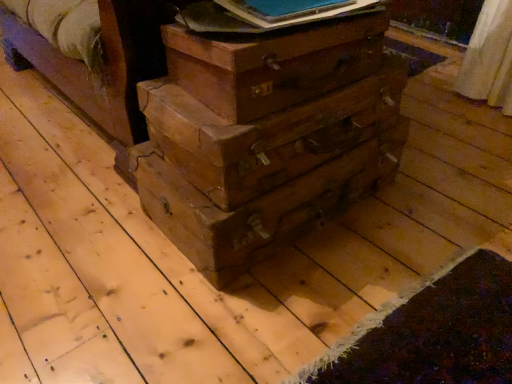
Question: Can you confirm if wooden drawer at center, placed as the second drawer when sorted from top to bottom, is wider than wooden drawer at center, the second drawer positioned from the bottom?

Choices:
 (A) no
 (B) yes

Answer: (B)

Question: Considering the relative sizes of wooden drawer at center, placed as the second drawer when sorted from top to bottom, and wooden drawer at center, the second drawer positioned from the bottom, in the image provided, is wooden drawer at center, placed as the second drawer when sorted from top to bottom, shorter than wooden drawer at center, the second drawer positioned from the bottom,?

Choices:
 (A) yes
 (B) no

Answer: (A)

Question: Does wooden drawer at center, placed as the second drawer when sorted from top to bottom, have a greater height compared to wooden drawer at center, the second drawer positioned from the bottom?

Choices:
 (A) yes
 (B) no

Answer: (B)

Question: From the image's perspective, does wooden drawer at center, placed as the second drawer when sorted from top to bottom, appear lower than wooden drawer at center, the second drawer positioned from the bottom?

Choices:
 (A) no
 (B) yes

Answer: (B)

Question: From a real-world perspective, is wooden drawer at center, which is counted as the 1th drawer, starting from the bottom, located higher than wooden drawer at center, the second drawer positioned from the bottom?

Choices:
 (A) yes
 (B) no

Answer: (B)

Question: From the image's perspective, is wooden drawer at center, which is counted as the 1th drawer, starting from the bottom, over wooden drawer at center, which is the 1th drawer from top to bottom?

Choices:
 (A) yes
 (B) no

Answer: (B)

Question: Is wooden drawer at center, the second drawer positioned from the bottom, bigger than blue paper at upper center?

Choices:
 (A) no
 (B) yes

Answer: (B)

Question: Is the surface of wooden drawer at center, the second drawer positioned from the bottom, in direct contact with blue paper at upper center?

Choices:
 (A) no
 (B) yes

Answer: (A)

Question: From a real-world perspective, is wooden drawer at center, which is the 1th drawer from top to bottom, positioned under blue paper at upper center based on gravity?

Choices:
 (A) no
 (B) yes

Answer: (B)

Question: Is wooden drawer at center, which is the 1th drawer from top to bottom, outside of blue paper at upper center?

Choices:
 (A) yes
 (B) no

Answer: (A)

Question: Does wooden drawer at center, the second drawer positioned from the bottom, have a smaller size compared to blue paper at upper center?

Choices:
 (A) no
 (B) yes

Answer: (A)

Question: Does wooden drawer at center, which is the 1th drawer from top to bottom, turn towards blue paper at upper center?

Choices:
 (A) no
 (B) yes

Answer: (A)

Question: Is blue paper at upper center smaller than wooden drawer at center, placed as the second drawer when sorted from top to bottom?

Choices:
 (A) yes
 (B) no

Answer: (A)